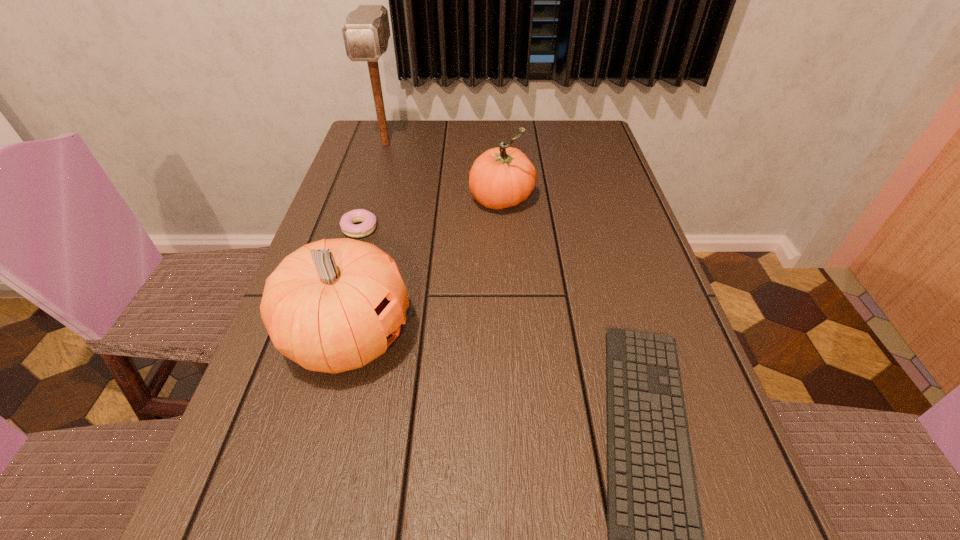
Where is `free space between the mallet and the doughnut`? free space between the mallet and the doughnut is located at coordinates (372, 186).

Find the location of a particular element. empty space that is in between the doughnut and the farthest object is located at coordinates (372, 186).

The image size is (960, 540). I want to click on vacant point located between the nearer pumpkin and the fourth object from left to right, so [x=425, y=269].

Image resolution: width=960 pixels, height=540 pixels. In order to click on vacant space that's between the tallest object and the second object from right to left in this screenshot , I will do `click(444, 172)`.

At what (x,y) coordinates should I click in order to perform the action: click on empty location between the fourth tallest object and the right pumpkin. Please return your answer as a coordinate pair (x, y). Looking at the image, I should click on (431, 214).

Find the location of a particular element. This screenshot has height=540, width=960. vacant area that lies between the farthest object and the left pumpkin is located at coordinates (367, 241).

Find the location of a particular element. object that is the fourth closest to the left pumpkin is located at coordinates tap(366, 32).

Point out which object is positioned as the nearest to the farther pumpkin. Please provide its 2D coordinates. Your answer should be formatted as a tuple, i.e. [(x, y)], where the tuple contains the x and y coordinates of a point satisfying the conditions above.

[(347, 221)]

Find the location of `vacant position in the image that satisfies the following two spatial constraints: 1. on the striking face of the right pumpkin; 2. on the left side of the mallet`. vacant position in the image that satisfies the following two spatial constraints: 1. on the striking face of the right pumpkin; 2. on the left side of the mallet is located at coordinates (369, 200).

I want to click on vacant region that satisfies the following two spatial constraints: 1. on the striking face of the farther pumpkin; 2. on the left side of the mallet, so click(369, 200).